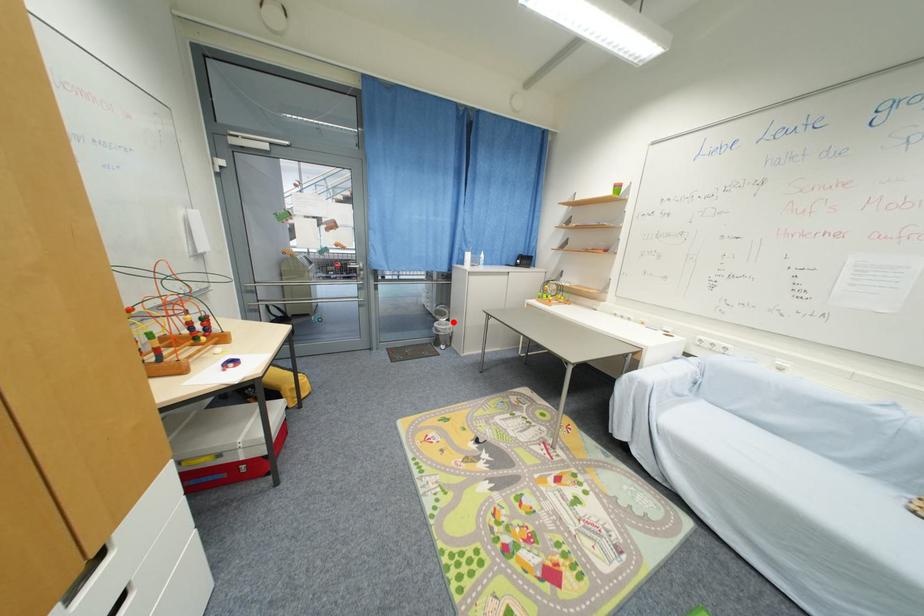
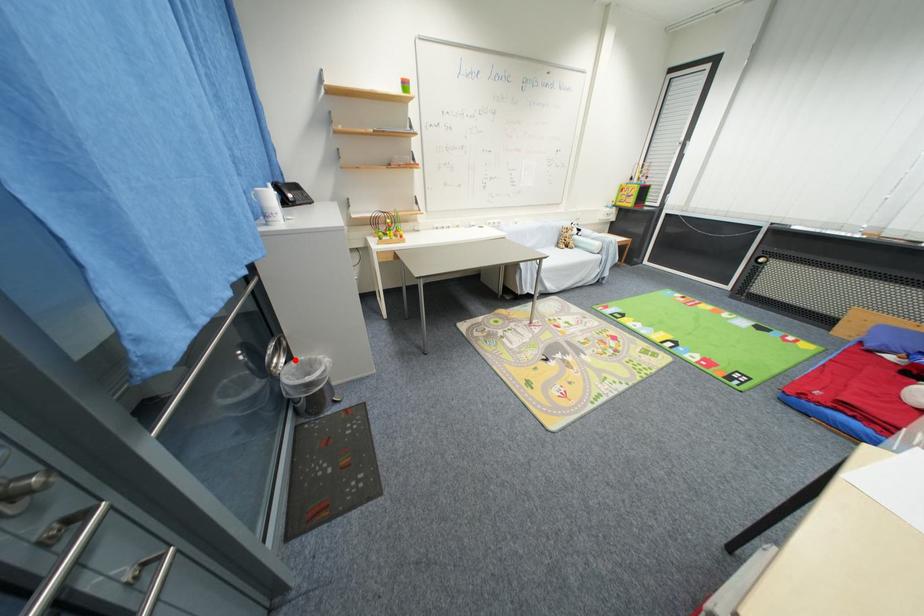
I am providing you with two images of the same scene from different viewpoints. A red point is marked on the first image and another point is marked on the second image. Are the points marked in image1 and image2 representing the same 3D position?

Yes